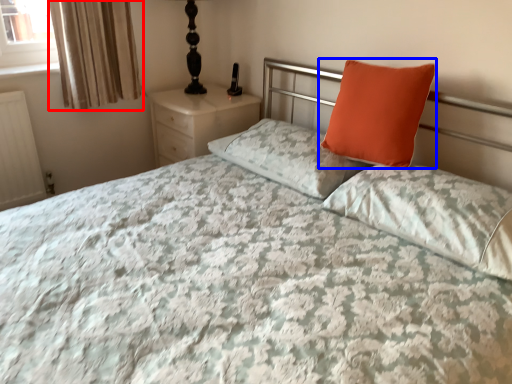
Question: Which object appears closest to the camera in this image, curtain (highlighted by a red box) or pillow (highlighted by a blue box)?

Choices:
 (A) curtain
 (B) pillow

Answer: (B)